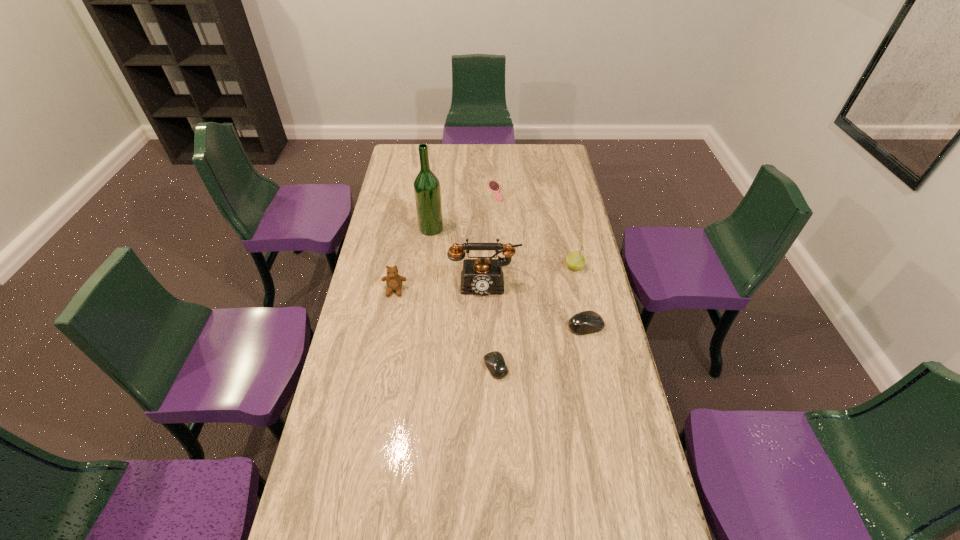
At what (x,y) coordinates should I click in order to perform the action: click on pear. Please return your answer as a coordinate pair (x, y). The height and width of the screenshot is (540, 960). Looking at the image, I should click on click(x=575, y=260).

In order to click on free space located on the front of the nearer mouse in this screenshot , I will do `click(497, 397)`.

Locate an element on the screen. The width and height of the screenshot is (960, 540). vacant region located 0.390m on the front of the taller mouse is located at coordinates (612, 450).

This screenshot has height=540, width=960. What are the coordinates of `free space located 0.210m on the front of the shortest object` in the screenshot? It's located at point(496,232).

Where is `vacant position located 0.400m on the right of the sixth nearest object`? vacant position located 0.400m on the right of the sixth nearest object is located at coordinates (537, 228).

The height and width of the screenshot is (540, 960). I want to click on vacant space situated 0.340m on the front-facing side of the leftmost object, so click(x=379, y=379).

Where is `free space located 0.090m on the front of the telephone at the rotary dial`? The height and width of the screenshot is (540, 960). free space located 0.090m on the front of the telephone at the rotary dial is located at coordinates (485, 316).

At what (x,y) coordinates should I click in order to perform the action: click on vacant space located 0.360m on the left of the pear. Please return your answer as a coordinate pair (x, y). This screenshot has height=540, width=960. Looking at the image, I should click on [x=473, y=267].

The height and width of the screenshot is (540, 960). In order to click on object located at the left edge in this screenshot , I will do `click(393, 280)`.

This screenshot has width=960, height=540. I want to click on mouse that is at the right edge, so click(586, 322).